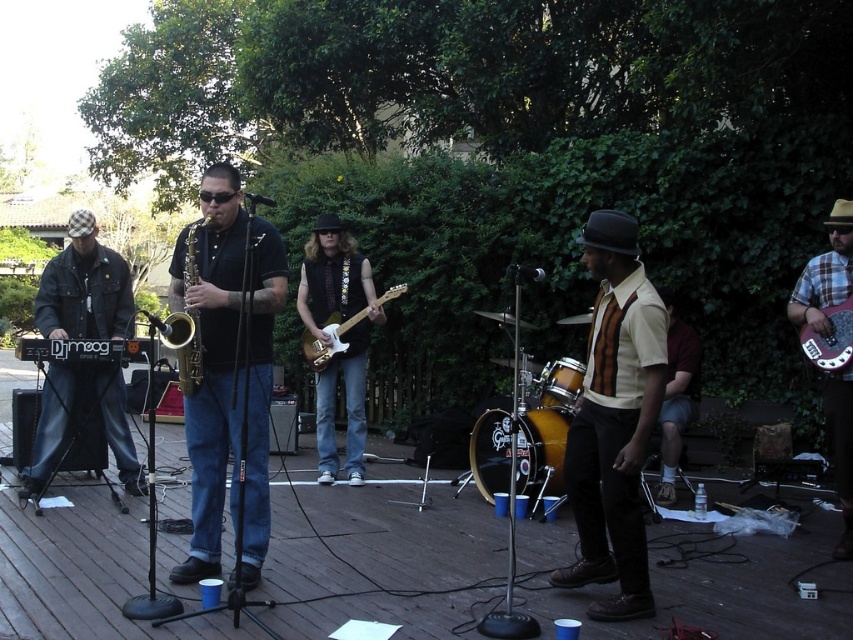
Can you confirm if brown plaid shirt at center is positioned to the right of matte electric guitar at center?

Yes, brown plaid shirt at center is to the right of matte electric guitar at center.

Is brown plaid shirt at center wider than matte electric guitar at center?

No.

Is point (610, 257) farther from viewer compared to point (328, 332)?

No, it is in front of (328, 332).

You are a GUI agent. You are given a task and a screenshot of the screen. Output one action in this format:
    pyautogui.click(x=<x>, y=<y>)
    Task: Click on the brown plaid shirt at center
    
    Given the screenshot: What is the action you would take?
    pyautogui.click(x=614, y=420)

Is shiny gold saxophone at center shorter than gold brass saxophone at center?

Incorrect, shiny gold saxophone at center's height does not fall short of gold brass saxophone at center's.

Does point (221, 241) come in front of point (166, 336)?

No.

This screenshot has height=640, width=853. I want to click on shiny gold saxophone at center, so click(x=230, y=371).

Is point (190, 579) positioned before point (167, 337)?

No, it is not.

Does gold saxophone at center have a larger size compared to gold brass saxophone at center?

Yes, gold saxophone at center is bigger than gold brass saxophone at center.

Between point (213, 467) and point (195, 365), which one is positioned behind?

The point (213, 467) is more distant.

Find the location of `gold saxophone at center`. gold saxophone at center is located at coordinates (212, 364).